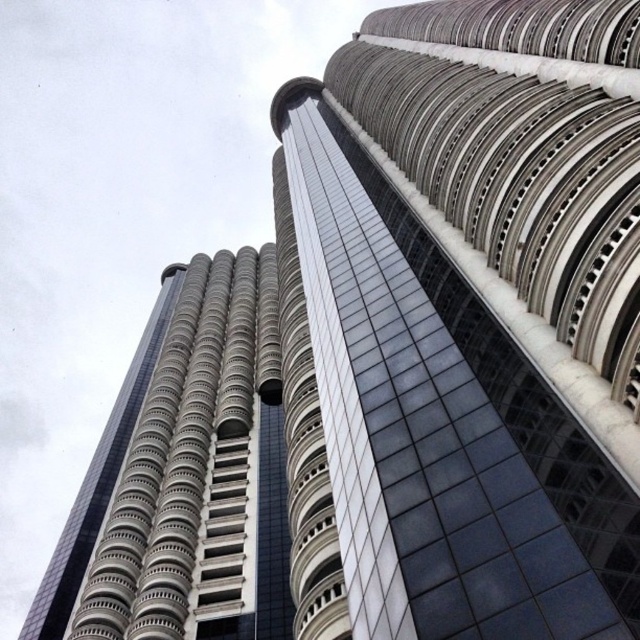
Who is taller, metallic glass skyscraper at center or silver metallic tower at center?

With more height is metallic glass skyscraper at center.

Does metallic glass skyscraper at center have a lesser height compared to silver metallic tower at center?

No.

Where is `metallic glass skyscraper at center`? The image size is (640, 640). metallic glass skyscraper at center is located at coordinates pyautogui.click(x=483, y=310).

Locate an element on the screen. The image size is (640, 640). metallic glass skyscraper at center is located at coordinates click(483, 310).